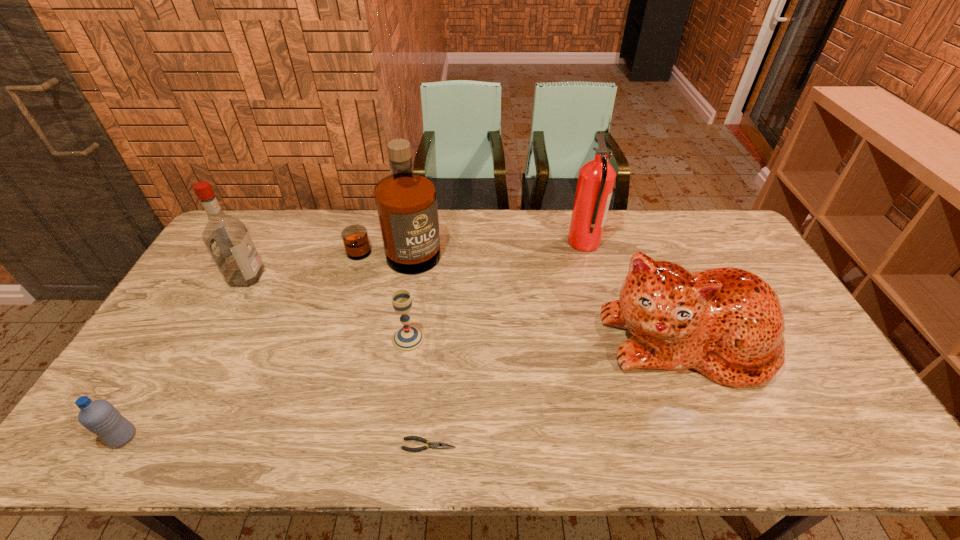
Identify the location of free spot between the cat and the shorter liquor. 466,309.

This screenshot has width=960, height=540. Find the location of `vacant area that lies between the cat and the chalice`. vacant area that lies between the cat and the chalice is located at coordinates (547, 340).

Image resolution: width=960 pixels, height=540 pixels. I want to click on vacant space that's between the taller liquor and the shorter liquor, so click(320, 267).

Where is `free space between the taller liquor and the shorter liquor`? This screenshot has height=540, width=960. free space between the taller liquor and the shorter liquor is located at coordinates (320, 267).

This screenshot has width=960, height=540. I want to click on vacant area between the cat and the taller liquor, so pos(540,299).

You are a GUI agent. You are given a task and a screenshot of the screen. Output one action in this format:
    pyautogui.click(x=<x>, y=<y>)
    Task: Click on the vacant point located between the left liquor and the pliers
    This screenshot has height=540, width=960.
    Given the screenshot: What is the action you would take?
    pyautogui.click(x=338, y=361)

Where is `blank region between the fire extinguisher and the water bottle`? blank region between the fire extinguisher and the water bottle is located at coordinates (353, 340).

In order to click on empty space that is in between the shorter liquor and the shortest object in this screenshot , I will do `click(338, 361)`.

Where is `object that stands as the closest to the fire extinguisher`? The width and height of the screenshot is (960, 540). object that stands as the closest to the fire extinguisher is located at coordinates (727, 323).

Select which object is the third closest to the right liquor. Please provide its 2D coordinates. Your answer should be formatted as a tuple, i.e. [(x, y)], where the tuple contains the x and y coordinates of a point satisfying the conditions above.

[(596, 179)]